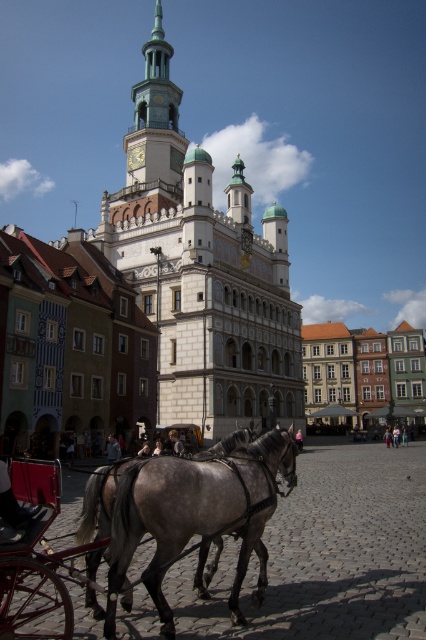
You are a tourist standing in the town square and want to take a photo of the matte orange building at right and the light blue fabric at center. Which object should you point your camera upwards to capture?

You should point your camera upwards to capture the matte orange building at right because it is located above the light blue fabric at center.

You are standing in the European town square and want to locate the point at coordinates (362, 371). Based on the scene description, which building should you look towards?

The point at coordinates (362, 371) is on the matte orange building at right, so you should look towards the matte orange building at right to locate it.